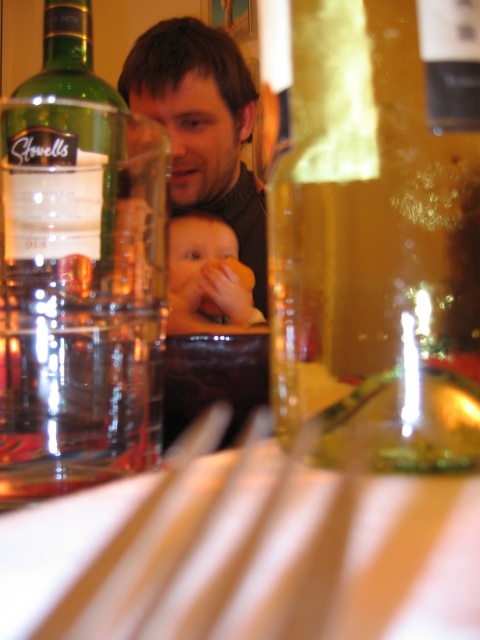
Question: Among these objects, which one is farthest from the camera?

Choices:
 (A) green glass bottle at upper left
 (B) smooth skin baby at center
 (C) matte black sweater at center

Answer: (B)

Question: In this image, where is green glass bottle at upper left located relative to matte black sweater at center?

Choices:
 (A) left
 (B) right

Answer: (B)

Question: Among these objects, which one is farthest from the camera?

Choices:
 (A) matte black sweater at center
 (B) green glass bottle at upper left
 (C) translucent glass bottle at center

Answer: (A)

Question: Can you confirm if green glass bottle at upper left is thinner than smooth skin baby at center?

Choices:
 (A) yes
 (B) no

Answer: (A)

Question: Is translucent glass bottle at center positioned at the back of matte black sweater at center?

Choices:
 (A) yes
 (B) no

Answer: (B)

Question: Which point is closer to the camera?

Choices:
 (A) matte black sweater at center
 (B) smooth skin baby at center
 (C) translucent glass bottle at center
 (D) green glass bottle at upper left

Answer: (C)